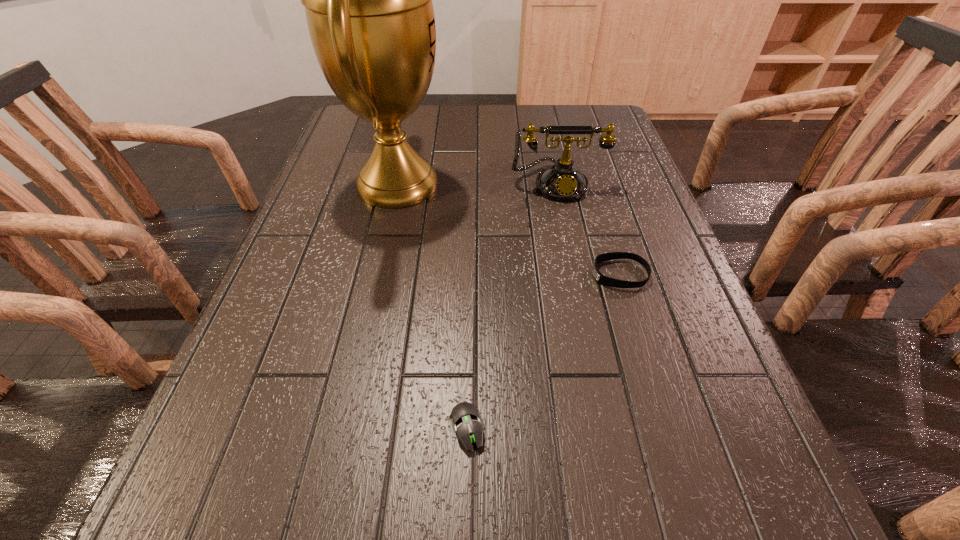
The width and height of the screenshot is (960, 540). In order to click on vacant region between the third object from right to left and the leftmost object in this screenshot , I will do `click(432, 306)`.

The width and height of the screenshot is (960, 540). Find the location of `free space between the third tallest object and the trophy cup`. free space between the third tallest object and the trophy cup is located at coordinates point(509,229).

Identify the location of free space between the shortest object and the third shortest object. (512, 306).

You are a GUI agent. You are given a task and a screenshot of the screen. Output one action in this format:
    pyautogui.click(x=<x>, y=<y>)
    Task: Click on the object that is the nearest to the second nearest object
    The image size is (960, 540).
    Given the screenshot: What is the action you would take?
    pyautogui.click(x=562, y=181)

Select which object is the second closest to the third tallest object. Please provide its 2D coordinates. Your answer should be formatted as a tuple, i.e. [(x, y)], where the tuple contains the x and y coordinates of a point satisfying the conditions above.

[(368, 0)]

You are a GUI agent. You are given a task and a screenshot of the screen. Output one action in this format:
    pyautogui.click(x=<x>, y=<y>)
    Task: Click on the vacant point that satisfies the following two spatial constraints: 1. on the surface of the leftmost object with symbols; 2. on the left side of the second object from left to right
    The height and width of the screenshot is (540, 960).
    Given the screenshot: What is the action you would take?
    pyautogui.click(x=343, y=428)

Find the location of a particular element. The image size is (960, 540). vacant space that satisfies the following two spatial constraints: 1. on the surface of the tallest object with symbols; 2. on the right side of the third object from right to left is located at coordinates (343, 428).

Locate an element on the screen. This screenshot has height=540, width=960. blank area in the image that satisfies the following two spatial constraints: 1. on the dial of the second tallest object; 2. on the surface of the tallest object with symbols is located at coordinates (558, 184).

You are a GUI agent. You are given a task and a screenshot of the screen. Output one action in this format:
    pyautogui.click(x=<x>, y=<y>)
    Task: Click on the vacant position in the image that satisfies the following two spatial constraints: 1. on the surface of the shortest object with symbols; 2. on the left side of the tallest object
    The height and width of the screenshot is (540, 960).
    Given the screenshot: What is the action you would take?
    pyautogui.click(x=343, y=428)

Find the location of a particular element. This screenshot has height=540, width=960. vacant space that satisfies the following two spatial constraints: 1. on the dial of the second tallest object; 2. on the surface of the tallest object with symbols is located at coordinates (558, 184).